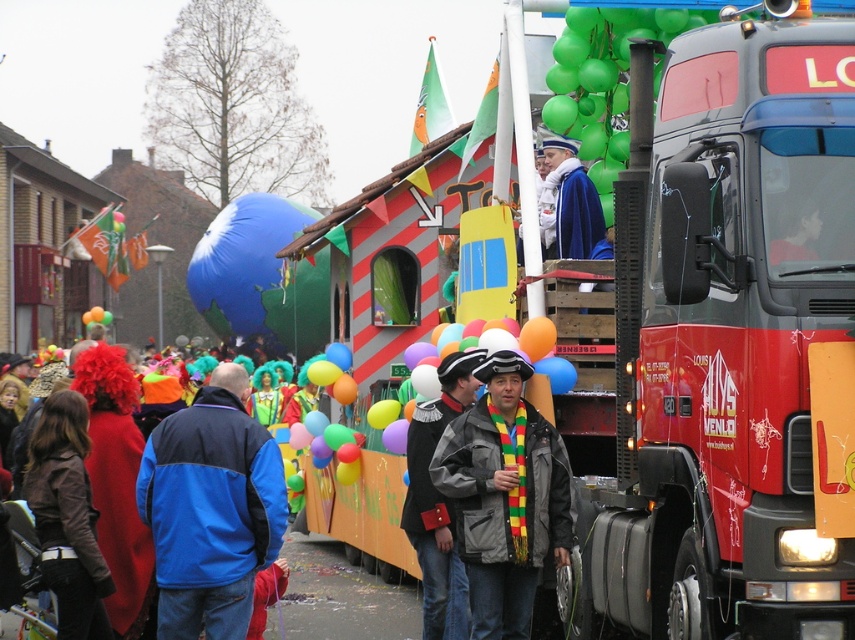
You are a photographer standing at the edge of the street. You want to take a photo that includes both the gray matte jacket at center and the blue glossy balloon at center. Which object should you focus on first to ensure both are in the frame?

You should focus on the gray matte jacket at center first because it is shorter than the blue glossy balloon at center, so adjusting the frame to include the taller balloon will naturally include the jacket as well.

You are a photographer trying to capture a photo of the blue glossy balloon at center and the gray matte jacket at center. Based on their positions, which object should you adjust your camera focus to first if you want to include both in the frame?

The gray matte jacket at center is to the right of the blue glossy balloon at center. To include both in the frame, you should adjust your camera focus to the blue glossy balloon at center first since it is on the left side, ensuring there is enough space for the gray matte jacket at center to the right.

You are a participant in the parade and you have a gray matte jacket at center. You want to avoid getting your jacket wet from any potential rain. Since the blue glossy balloon at center is above you, would the balloon provide any protection from the rain?

The gray matte jacket at center is positioned under blue glossy balloon at center. However, the balloon is made of lightweight material and does not provide adequate shelter from rain, so it won